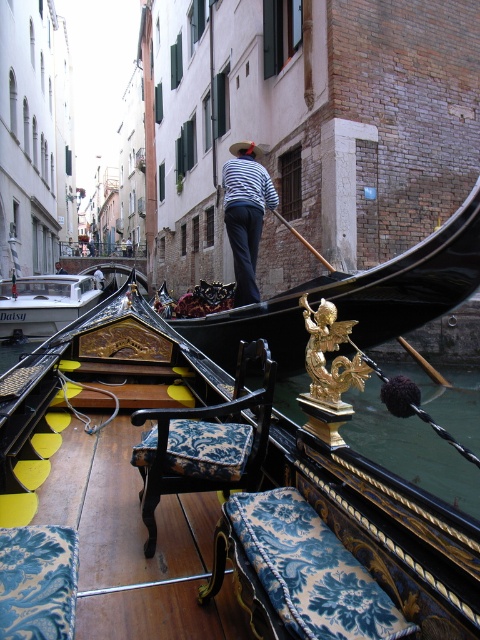
You are a tourist standing on the bridge overlooking the canal and see the gold ornate gondola at center and the striped fabric shirt at upper center. Which object is positioned lower in the scene?

The gold ornate gondola at center is located below the striped fabric shirt at upper center, so the gold ornate gondola at center is positioned lower in the scene.

You are a passenger sitting in the gondola and want to rest your head on the blue damask cushion at center. Can you reach it from your current position, considering your height and the cushion is in front of the striped fabric shirt at upper center?

The blue damask cushion at center is in front of the striped fabric shirt at upper center, so yes, you can reach it as it is positioned closer to you than the shirt.

You are a tourist standing on the bridge overlooking the canal. You see the gold ornate gondola at center and the striped fabric shirt at upper center. Which object is located to the right when viewed from your perspective?

The gold ornate gondola at center is positioned on the right side of striped fabric shirt at upper center, so from your perspective on the bridge, the gold ornate gondola at center is to the right of the striped fabric shirt at upper center.